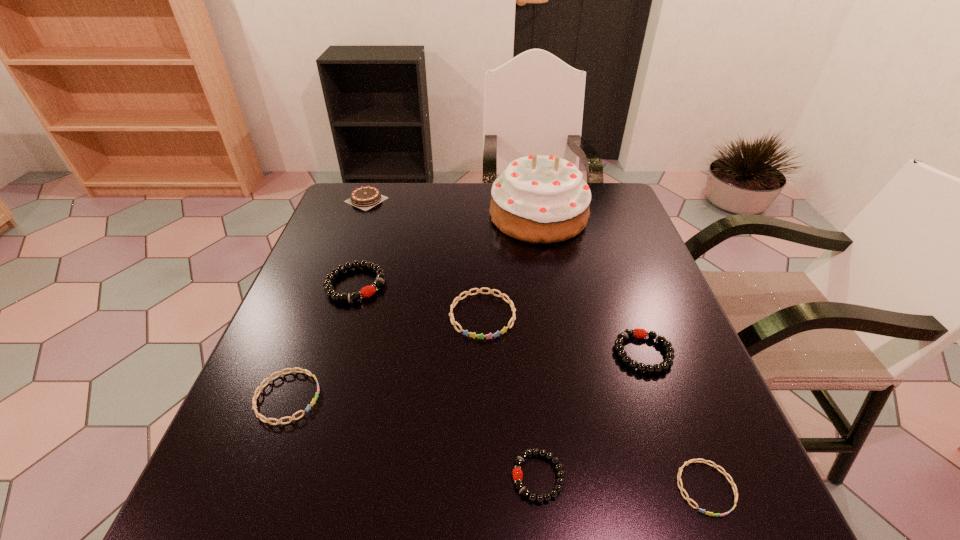
The image size is (960, 540). I want to click on cake, so click(543, 199).

Find the location of a particular element. The width and height of the screenshot is (960, 540). the tallest object is located at coordinates (543, 199).

Where is `brown chocolate cake`? brown chocolate cake is located at coordinates (368, 196).

Locate an element on the screen. The height and width of the screenshot is (540, 960). chocolate cake is located at coordinates (368, 196).

Find the location of a particular element. The image size is (960, 540). the farthest black bracelet is located at coordinates (367, 291).

Where is `the leftmost black bracelet`? Image resolution: width=960 pixels, height=540 pixels. the leftmost black bracelet is located at coordinates (367, 291).

What are the coordinates of `the second blue bracelet from right to left` in the screenshot? It's located at (480, 336).

Find the location of `the biggest blue bracelet`. the biggest blue bracelet is located at coordinates (480, 336).

Locate an element on the screen. The height and width of the screenshot is (540, 960). the rightmost black bracelet is located at coordinates (637, 333).

In order to click on the second biggest black bracelet in this screenshot , I will do `click(637, 333)`.